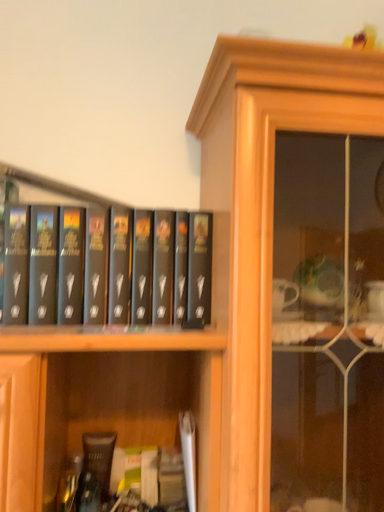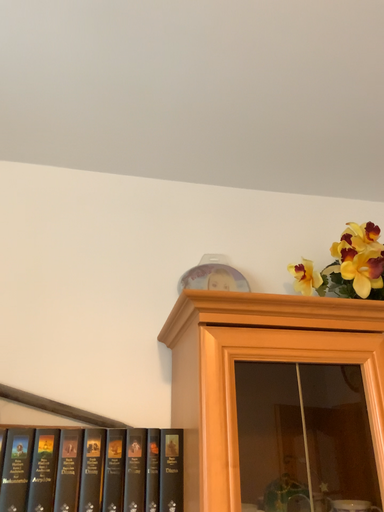
Question: How did the camera likely rotate when shooting the video?

Choices:
 (A) rotated downward
 (B) rotated upward

Answer: (B)